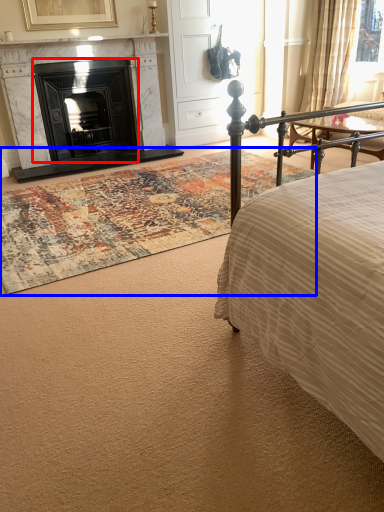
Question: Which of the following is the farthest to the observer, fireplace (highlighted by a red box) or mat (highlighted by a blue box)?

Choices:
 (A) fireplace
 (B) mat

Answer: (A)